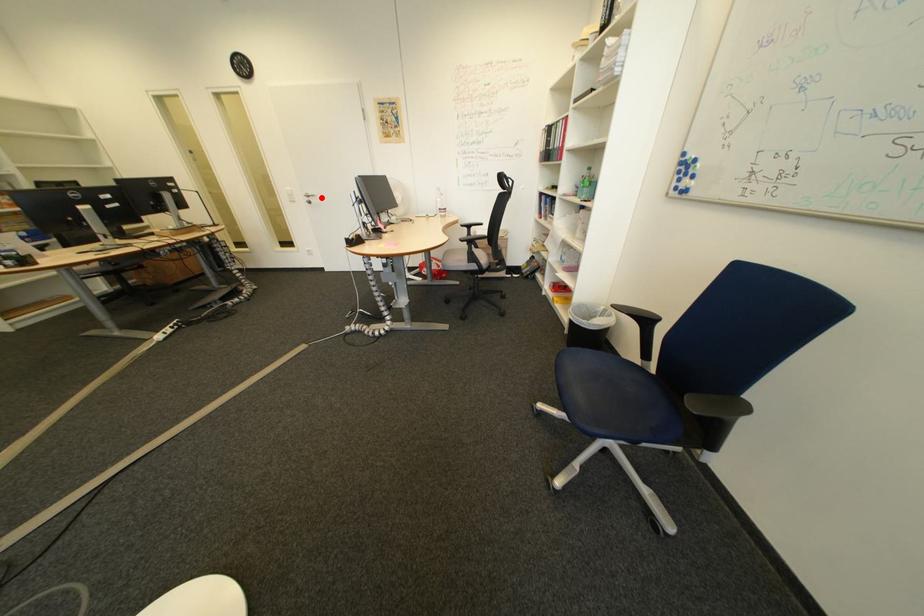
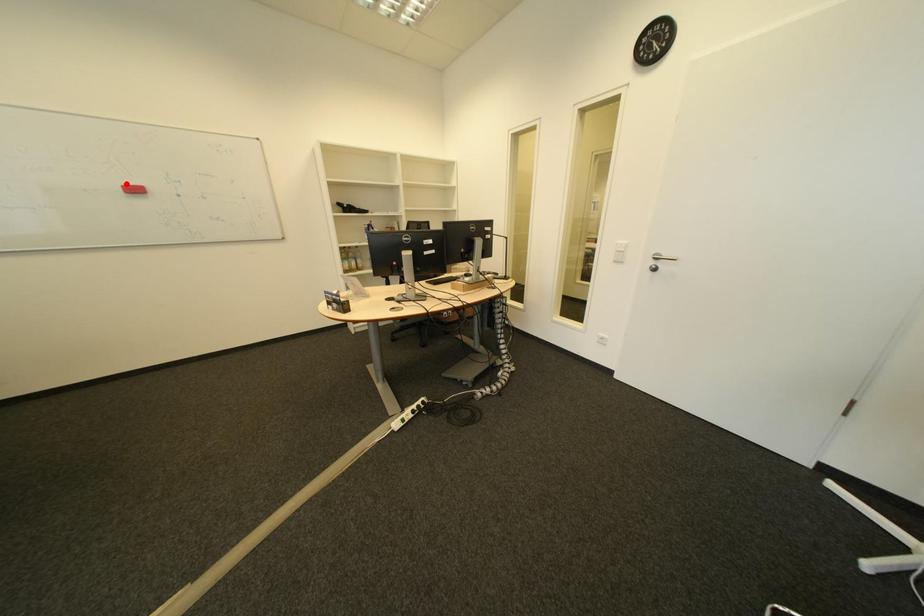
I am providing you with two images of the same scene from different viewpoints. A red point is marked on the first image and another point is marked on the second image. Do the highlighted points in image1 and image2 indicate the same real-world spot?

No